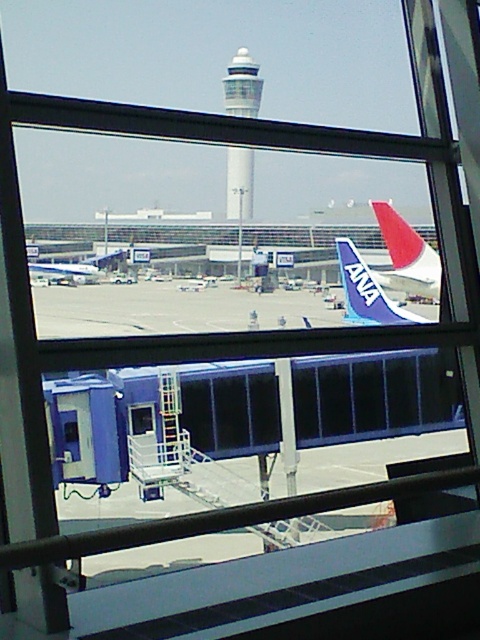
Based on the photo, is gray concrete tarmac at center positioned at the back of light gray concrete control tower at upper center?

That is False.

Which is more to the left, gray concrete tarmac at center or light gray concrete control tower at upper center?

light gray concrete control tower at upper center is more to the left.

Does point (51, 285) come in front of point (239, 212)?

Yes.

The height and width of the screenshot is (640, 480). I want to click on gray concrete tarmac at center, so click(168, 308).

Is blue fabric airplane tail at right positioned at the back of blue metallic airplane at center?

No, it is not.

Find the location of a particular element. Image resolution: width=480 pixels, height=640 pixels. blue fabric airplane tail at right is located at coordinates (368, 292).

I want to click on blue fabric airplane tail at right, so click(x=368, y=292).

Can you confirm if gray concrete tarmac at center is thinner than blue metallic airplane at center?

No.

Which is more to the right, gray concrete tarmac at center or blue metallic airplane at center?

gray concrete tarmac at center

The width and height of the screenshot is (480, 640). I want to click on gray concrete tarmac at center, so click(x=168, y=308).

Find the location of `gray concrete tarmac at center`. gray concrete tarmac at center is located at coordinates (168, 308).